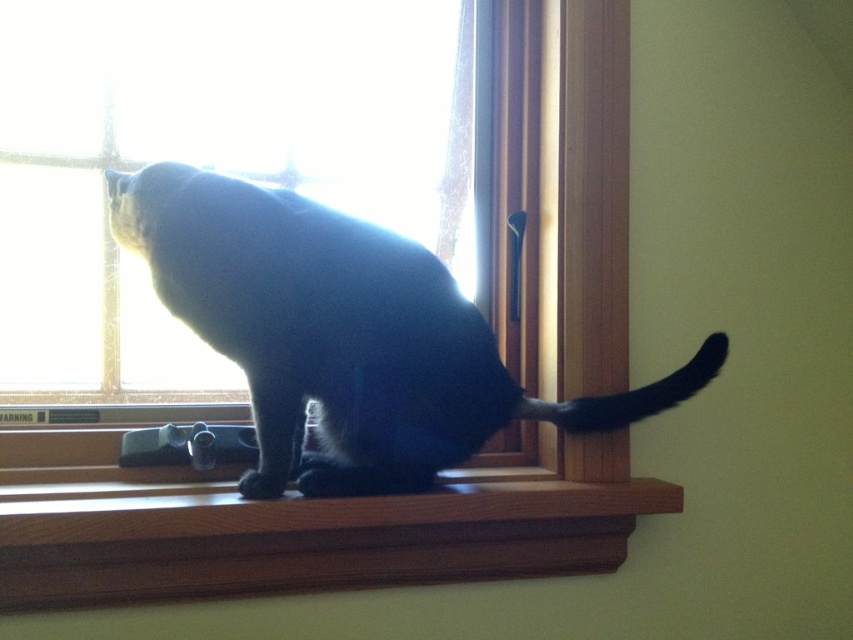
You are a photographer trying to capture the black cat on the wooden windowsill. You need to position your camera so that the clear glass window at upper left and the wooden at center are both in the frame. Which object should you focus on first if you want to ensure both are in focus?

You should focus on the wooden at center first because the clear glass window at upper left is located above it, so adjusting focus starting from the closer object will help ensure both are in focus.

From the picture: You are holding a 1.2 meter long fishing rod and want to place it horizontally on the clear glass window at upper left. Can you fit the entire fishing rod on the window without any part hanging off the edges?

The clear glass window at upper left and viewer are 1.35 meters apart from each other. Since the fishing rod is 1.2 meters long, it can fit on the window as the window is longer than the rod.